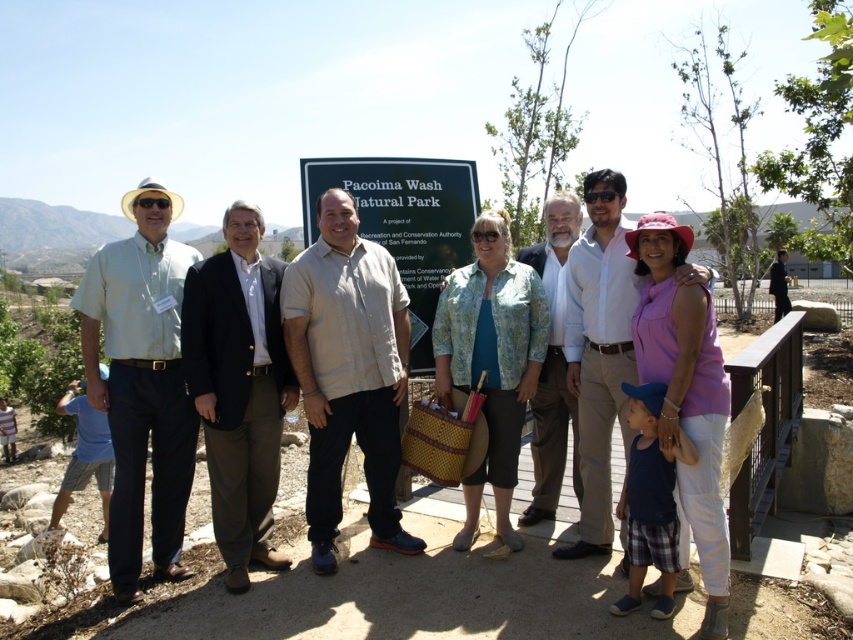
You are a photographer who wants to capture both the light blue shirt at left and the light blue shirt at center in the same frame. Which one should you focus on first to ensure both are in the shot?

The light blue shirt at left is positioned on the left side of light blue shirt at center, so focus on the light blue shirt at left first to include both in the frame.

You are a photographer trying to capture a group photo of the beige cotton shirt at center and the light blue shirt at center. Which person should you position closer to the camera to ensure both appear equally tall in the photo?

You should position the beige cotton shirt at center closer to the camera since it is shorter than the light blue shirt at center, making them appear the same height in the photo.